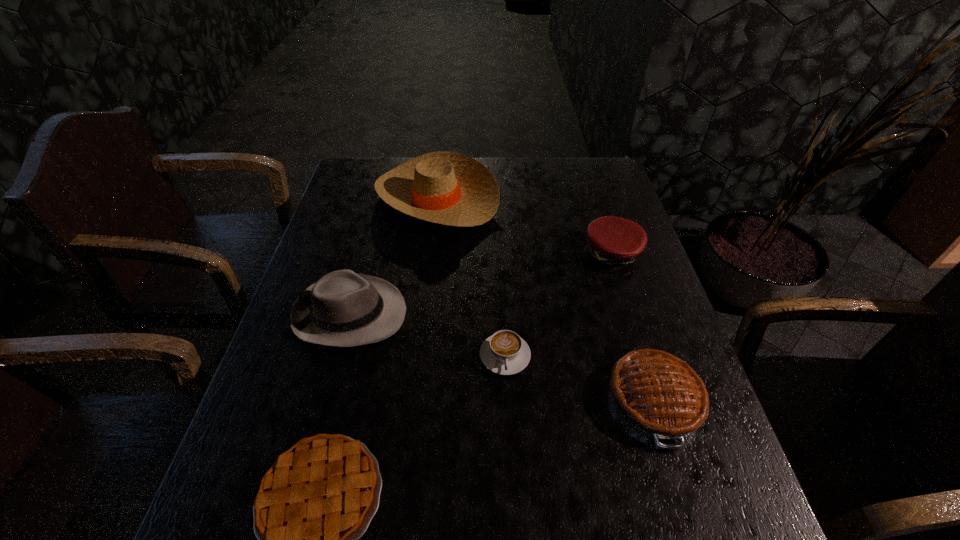
At what (x,y) coordinates should I click in order to perform the action: click on sunhat. Please return your answer as a coordinate pair (x, y). The width and height of the screenshot is (960, 540). Looking at the image, I should click on (443, 187).

Locate an element on the screen. This screenshot has height=540, width=960. fedora is located at coordinates (342, 309).

Identify the location of cap. (614, 242).

This screenshot has width=960, height=540. Find the location of `the taller pie`. the taller pie is located at coordinates (656, 393).

The height and width of the screenshot is (540, 960). I want to click on the fifth tallest object, so click(x=505, y=352).

Identify the location of vacant space located 0.110m on the left of the sunhat. The image size is (960, 540). (342, 197).

At what (x,y) coordinates should I click in order to perform the action: click on vacant space located on the front-facing side of the fedora. Please return your answer as a coordinate pair (x, y). Looking at the image, I should click on (468, 314).

In order to click on vacant region located at the front of the cap where the visor is located in this screenshot , I will do `click(646, 366)`.

Locate an element on the screen. The width and height of the screenshot is (960, 540). vacant space located on the left of the right pie is located at coordinates (544, 400).

Locate an element on the screen. vacant region located 0.110m on the side of the cappuccino with the handle is located at coordinates (508, 426).